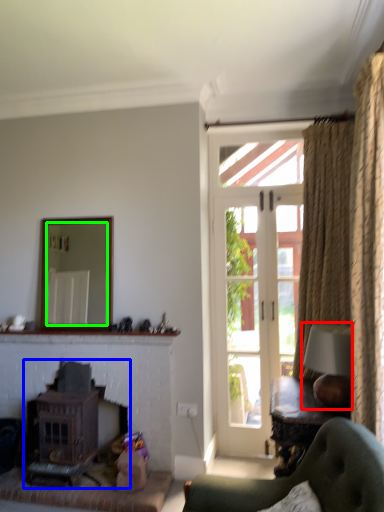
Question: Estimate the real-world distances between objects in this image. Which object is farther from lamp (highlighted by a red box), fireplace (highlighted by a blue box) or mirror (highlighted by a green box)?

Choices:
 (A) fireplace
 (B) mirror

Answer: (A)